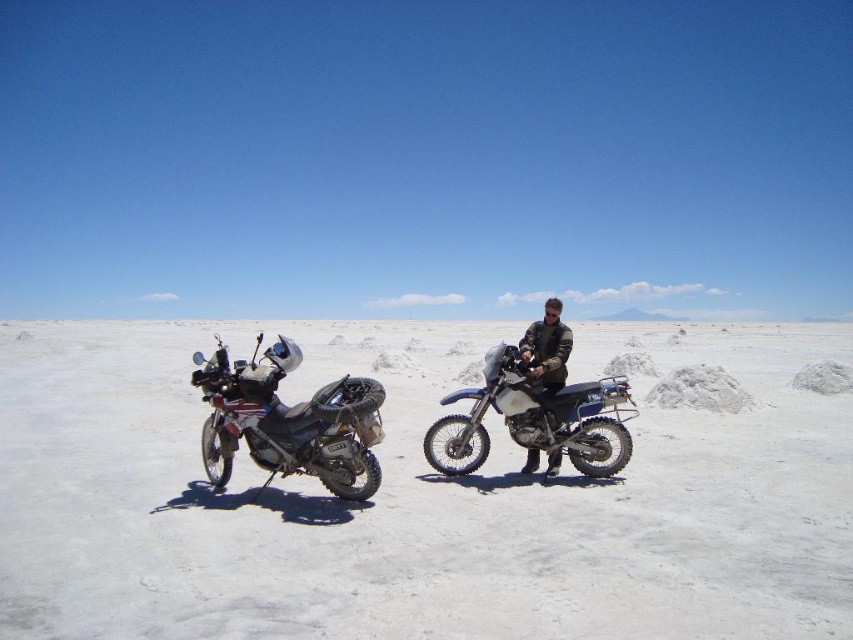
Question: Which object is closer to the camera taking this photo?

Choices:
 (A) matte black motorcycle at center
 (B) matte black motorcycle at left
 (C) dark brown leather jacket at center
 (D) white matte dirt bike at center

Answer: (D)

Question: Among these objects, which one is farthest from the camera?

Choices:
 (A) matte black motorcycle at left
 (B) white matte dirt bike at center

Answer: (A)

Question: Is white matte dirt bike at center to the right of matte black motorcycle at center from the viewer's perspective?

Choices:
 (A) no
 (B) yes

Answer: (A)

Question: Is the position of white matte dirt bike at center more distant than that of matte black motorcycle at center?

Choices:
 (A) yes
 (B) no

Answer: (B)

Question: Which is farther from the matte black motorcycle at left?

Choices:
 (A) matte black motorcycle at center
 (B) dark brown leather jacket at center
 (C) white matte dirt bike at center

Answer: (C)

Question: Can you confirm if matte black motorcycle at center is wider than dark brown leather jacket at center?

Choices:
 (A) no
 (B) yes

Answer: (A)